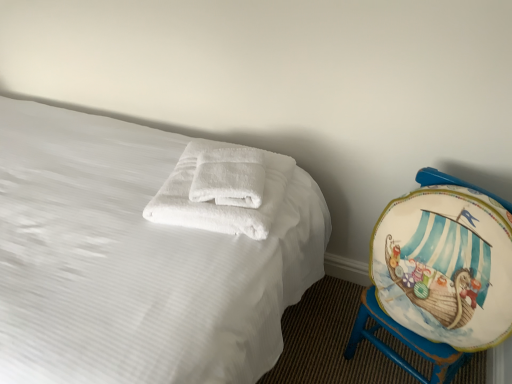
Question: Does white fluffy towels at center appear on the right side of painted wood globe at right?

Choices:
 (A) no
 (B) yes

Answer: (A)

Question: From a real-world perspective, does white fluffy towels at center sit lower than painted wood globe at right?

Choices:
 (A) yes
 (B) no

Answer: (B)

Question: From the image's perspective, is white fluffy towels at center beneath painted wood globe at right?

Choices:
 (A) no
 (B) yes

Answer: (A)

Question: Is white fluffy towels at center closer to camera compared to painted wood globe at right?

Choices:
 (A) yes
 (B) no

Answer: (B)

Question: Is white fluffy towels at center to the left of painted wood globe at right from the viewer's perspective?

Choices:
 (A) yes
 (B) no

Answer: (A)

Question: Do you think white soft towel at center is within painted wood globe at right, or outside of it?

Choices:
 (A) outside
 (B) inside

Answer: (A)

Question: Would you say white soft towel at center is to the left or to the right of painted wood globe at right in the picture?

Choices:
 (A) left
 (B) right

Answer: (A)

Question: From a real-world perspective, is white soft towel at center positioned above or below painted wood globe at right?

Choices:
 (A) above
 (B) below

Answer: (B)

Question: Considering the positions of white soft towel at center and painted wood globe at right in the image, is white soft towel at center taller or shorter than painted wood globe at right?

Choices:
 (A) tall
 (B) short

Answer: (A)

Question: Based on their sizes in the image, would you say painted wood globe at right is bigger or smaller than white soft towel at center?

Choices:
 (A) big
 (B) small

Answer: (B)

Question: Is painted wood globe at right in front of or behind white soft towel at center in the image?

Choices:
 (A) front
 (B) behind

Answer: (B)

Question: In the image, is painted wood globe at right on the left side or the right side of white soft towel at center?

Choices:
 (A) right
 (B) left

Answer: (A)

Question: Is painted wood globe at right spatially inside white soft towel at center, or outside of it?

Choices:
 (A) outside
 (B) inside

Answer: (A)

Question: Looking at their shapes, would you say white soft towel at center is wider or thinner than white fluffy towels at center?

Choices:
 (A) wide
 (B) thin

Answer: (B)

Question: From the image's perspective, is white soft towel at center above or below white fluffy towels at center?

Choices:
 (A) below
 (B) above

Answer: (B)